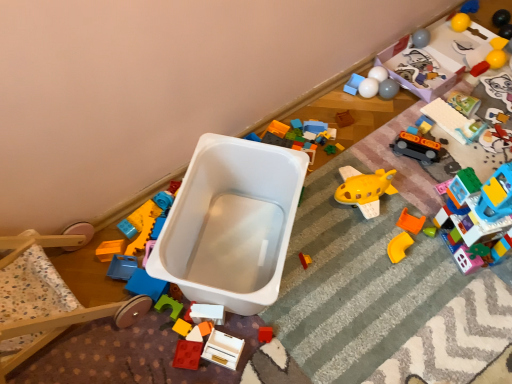
Locate an element on the screen. The width and height of the screenshot is (512, 384). vacant space in front of white plastic baby carriage at center is located at coordinates (243, 350).